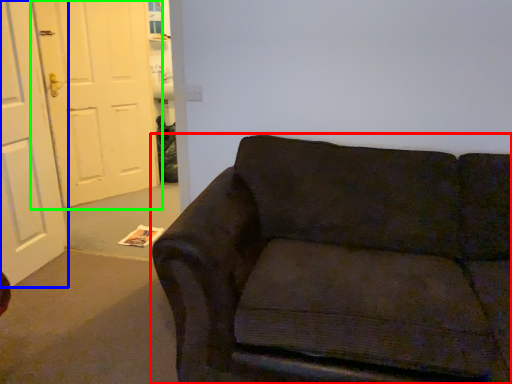
Question: Which object is positioned farthest from studio couch (highlighted by a red box)? Select from door (highlighted by a blue box) and door (highlighted by a green box).

Choices:
 (A) door
 (B) door

Answer: (B)